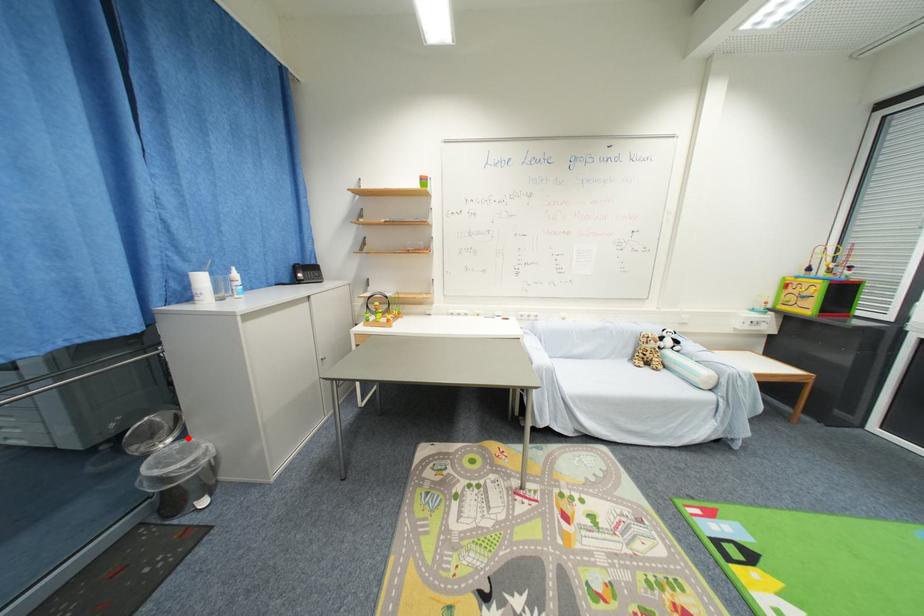
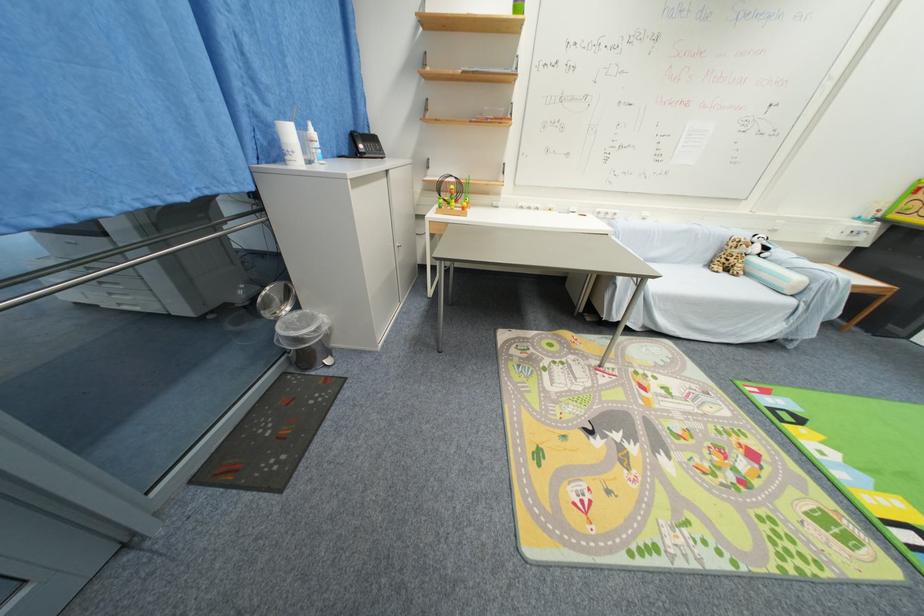
In the second image, find the point that corresponds to the highlighted location in the first image.

(301, 309)